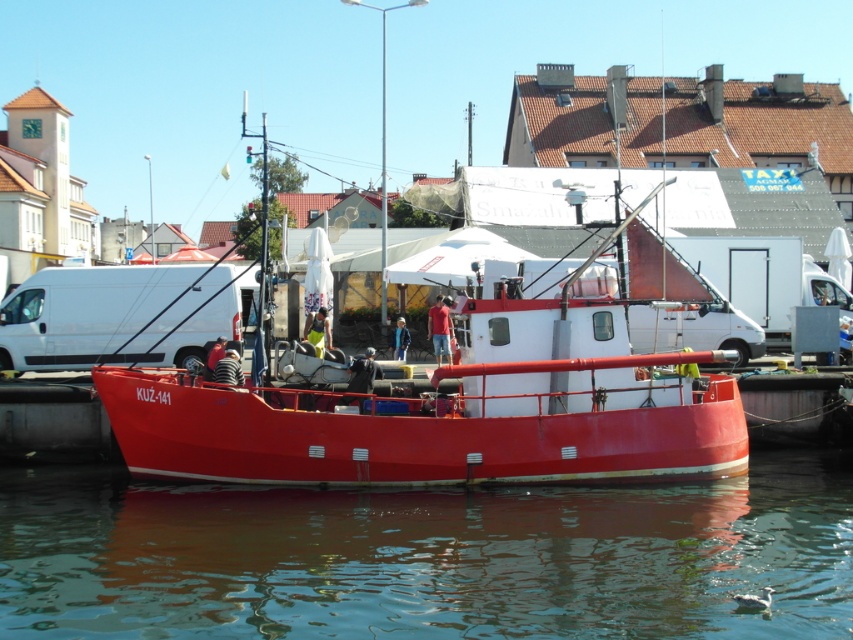
From the picture: You are a photographer standing at the dock and want to capture both the metallic red boat at center and the white matte van at center in a single photo. Which object should you position closer to the left side of your camera frame to include both in the shot?

Since the metallic red boat at center is to the right of the white matte van at center, you should position the white matte van at center closer to the left side of your camera frame to include both in the shot.

You are a delivery person who needs to park your white matte van at center near the metallic red boat at center. Given that the boat is wider than the van, can you safely park the van next to the boat without overlapping?

The metallic red boat at center is wider than the white matte van at center. Since the boat is wider, there should be enough space to park the van next to the boat without overlapping, as the van is narrower.